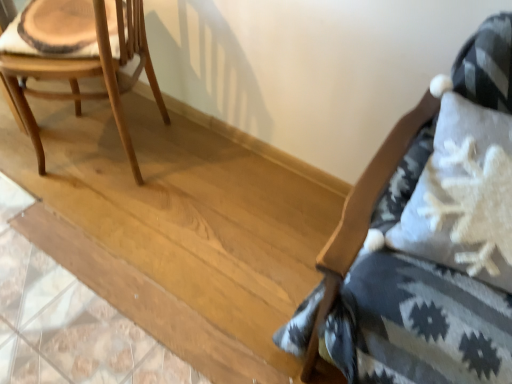
Question: Considering the relative sizes of natural wood chair at left, the second chair viewed from the right, and textured gray cushion at right, the first chair viewed from the right, in the image provided, is natural wood chair at left, the second chair viewed from the right, shorter than textured gray cushion at right, the first chair viewed from the right,?

Choices:
 (A) no
 (B) yes

Answer: (B)

Question: From a real-world perspective, is natural wood chair at left, which ranks as the first chair in left-to-right order, on textured gray cushion at right, the first chair viewed from the right?

Choices:
 (A) yes
 (B) no

Answer: (B)

Question: Is natural wood chair at left, which ranks as the first chair in left-to-right order, to the right of textured gray cushion at right, acting as the second chair starting from the left, from the viewer's perspective?

Choices:
 (A) yes
 (B) no

Answer: (B)

Question: From the image's perspective, is natural wood chair at left, which ranks as the first chair in left-to-right order, located above textured gray cushion at right, acting as the second chair starting from the left?

Choices:
 (A) no
 (B) yes

Answer: (B)

Question: Is natural wood chair at left, which ranks as the first chair in left-to-right order, taller than textured gray cushion at right, acting as the second chair starting from the left?

Choices:
 (A) yes
 (B) no

Answer: (B)

Question: Is natural wood chair at left, the second chair viewed from the right, at the left side of textured gray cushion at right, acting as the second chair starting from the left?

Choices:
 (A) no
 (B) yes

Answer: (B)

Question: Is textured gray cushion at right, acting as the second chair starting from the left, not close to natural wood chair at left, the second chair viewed from the right?

Choices:
 (A) no
 (B) yes

Answer: (B)

Question: From a real-world perspective, is textured gray cushion at right, the first chair viewed from the right, below natural wood chair at left, which ranks as the first chair in left-to-right order?

Choices:
 (A) yes
 (B) no

Answer: (B)

Question: From the image's perspective, would you say textured gray cushion at right, the first chair viewed from the right, is positioned over natural wood chair at left, the second chair viewed from the right?

Choices:
 (A) yes
 (B) no

Answer: (B)

Question: From the image's perspective, is textured gray cushion at right, acting as the second chair starting from the left, beneath natural wood chair at left, the second chair viewed from the right?

Choices:
 (A) yes
 (B) no

Answer: (A)

Question: Is the position of textured gray cushion at right, the first chair viewed from the right, less distant than that of natural wood chair at left, the second chair viewed from the right?

Choices:
 (A) yes
 (B) no

Answer: (A)

Question: Is textured gray cushion at right, the first chair viewed from the right, positioned beyond the bounds of natural wood chair at left, the second chair viewed from the right?

Choices:
 (A) yes
 (B) no

Answer: (A)

Question: Considering their positions, is textured gray cushion at right, acting as the second chair starting from the left, located in front of or behind natural wood chair at left, the second chair viewed from the right?

Choices:
 (A) front
 (B) behind

Answer: (A)